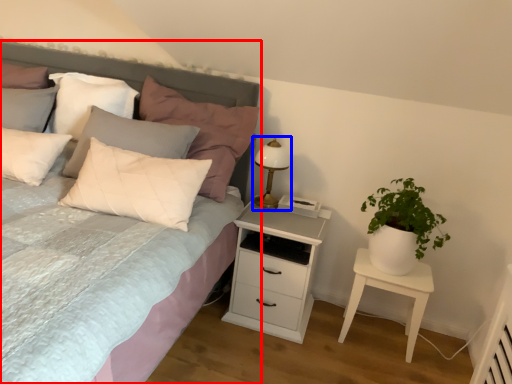
Question: Which object appears farthest to the camera in this image, bed (highlighted by a red box) or bedside lamp (highlighted by a blue box)?

Choices:
 (A) bed
 (B) bedside lamp

Answer: (B)